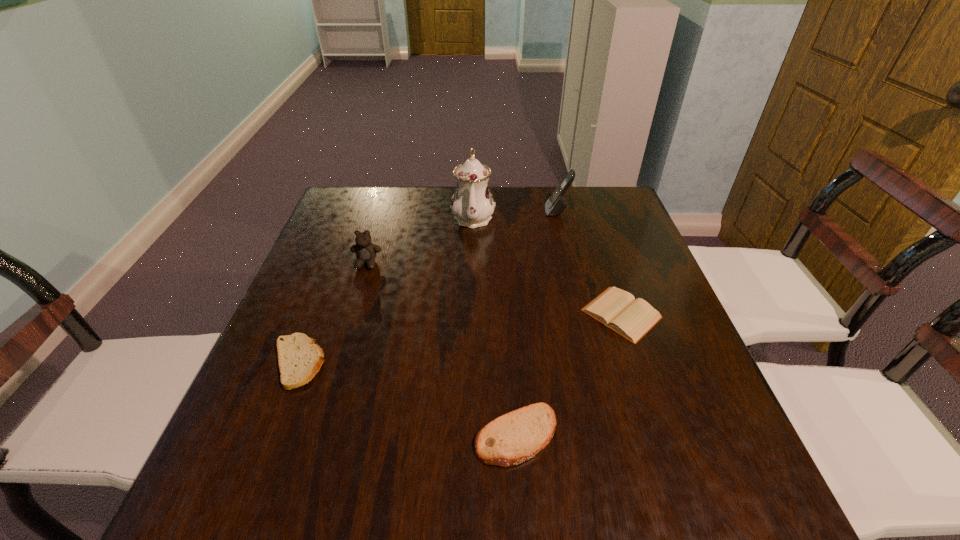
You are a GUI agent. You are given a task and a screenshot of the screen. Output one action in this format:
    pyautogui.click(x=<x>, y=<y>)
    Task: Click on the free spot between the second tallest object and the taller pita bread
    The width and height of the screenshot is (960, 540).
    Given the screenshot: What is the action you would take?
    pyautogui.click(x=537, y=323)

Where is `empty space between the third farthest object and the cellular telephone`? The width and height of the screenshot is (960, 540). empty space between the third farthest object and the cellular telephone is located at coordinates (462, 238).

You are a GUI agent. You are given a task and a screenshot of the screen. Output one action in this format:
    pyautogui.click(x=<x>, y=<y>)
    Task: Click on the free space between the cellular telephone and the fourth nearest object
    This screenshot has width=960, height=540.
    Given the screenshot: What is the action you would take?
    pyautogui.click(x=462, y=238)

This screenshot has height=540, width=960. I want to click on empty location between the fourth shortest object and the cellular telephone, so click(x=462, y=238).

The image size is (960, 540). Find the location of `free space between the diary and the third tallest object`. free space between the diary and the third tallest object is located at coordinates (494, 289).

Where is `vacant space that is in between the fourth shortest object and the chinaware`? vacant space that is in between the fourth shortest object and the chinaware is located at coordinates (420, 240).

Identify the location of free space between the fourth shortest object and the taller pita bread. (442, 349).

Find the location of a particular element. vacant space that is in between the diary and the taller pita bread is located at coordinates (569, 375).

Point out which object is positioned as the fifth nearest to the chinaware. Please provide its 2D coordinates. Your answer should be formatted as a tuple, i.e. [(x, y)], where the tuple contains the x and y coordinates of a point satisfying the conditions above.

[(513, 438)]

Point out which object is positioned as the fourth nearest to the third tallest object. Please provide its 2D coordinates. Your answer should be formatted as a tuple, i.e. [(x, y)], where the tuple contains the x and y coordinates of a point satisfying the conditions above.

[(555, 205)]